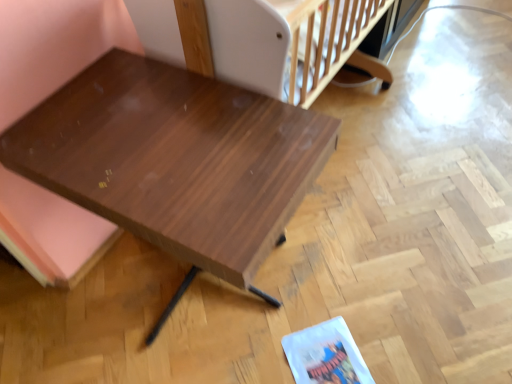
Describe the element at coordinates (175, 161) in the screenshot. The width and height of the screenshot is (512, 384). I see `shiny brown wood table at center` at that location.

You are a GUI agent. You are given a task and a screenshot of the screen. Output one action in this format:
    pyautogui.click(x=<x>, y=<y>)
    Task: Click on the shiny brown wood table at center
    The image size is (512, 384).
    Given the screenshot: What is the action you would take?
    pyautogui.click(x=175, y=161)

The height and width of the screenshot is (384, 512). What are the coordinates of `white plastic infant bed at upper center` in the screenshot? It's located at (288, 42).

Describe the element at coordinates (288, 42) in the screenshot. I see `white plastic infant bed at upper center` at that location.

I want to click on shiny brown wood table at center, so click(x=175, y=161).

Would you say white plastic infant bed at upper center is to the left or to the right of shiny brown wood table at center in the picture?

Clearly, white plastic infant bed at upper center is on the right of shiny brown wood table at center in the image.

Does white plastic infant bed at upper center lie in front of shiny brown wood table at center?

No, it is not.

Between point (264, 43) and point (257, 139), which one is positioned in front?

The point (257, 139) is more forward.

From the image's perspective, which is above, white plastic infant bed at upper center or shiny brown wood table at center?

white plastic infant bed at upper center appears higher in the image.

From a real-world perspective, is white plastic infant bed at upper center positioned under shiny brown wood table at center based on gravity?

No, from a real-world perspective, white plastic infant bed at upper center is not below shiny brown wood table at center.

Is white plastic infant bed at upper center wider or thinner than shiny brown wood table at center?

Clearly, white plastic infant bed at upper center has less width compared to shiny brown wood table at center.

Is white plastic infant bed at upper center taller or shorter than shiny brown wood table at center?

Considering their sizes, white plastic infant bed at upper center has less height than shiny brown wood table at center.

Considering the relative sizes of white plastic infant bed at upper center and shiny brown wood table at center in the image provided, is white plastic infant bed at upper center bigger than shiny brown wood table at center?

Incorrect, white plastic infant bed at upper center is not larger than shiny brown wood table at center.

Is white plastic infant bed at upper center completely or partially outside of shiny brown wood table at center?

Yes, white plastic infant bed at upper center is located beyond the bounds of shiny brown wood table at center.

Is white plastic infant bed at upper center not near shiny brown wood table at center?

No, white plastic infant bed at upper center is not far from shiny brown wood table at center.

Is white plastic infant bed at upper center facing towards shiny brown wood table at center?

No, white plastic infant bed at upper center does not turn towards shiny brown wood table at center.

Measure the distance between white plastic infant bed at upper center and shiny brown wood table at center.

12.18 inches.

You are a GUI agent. You are given a task and a screenshot of the screen. Output one action in this format:
    pyautogui.click(x=<x>, y=<y>)
    Task: Click on the infant bed above the shiny brown wood table at center (from a real-world perspective)
    The image size is (512, 384).
    Given the screenshot: What is the action you would take?
    pyautogui.click(x=288, y=42)

Which is more to the left, shiny brown wood table at center or white plastic infant bed at upper center?

shiny brown wood table at center is more to the left.

Between shiny brown wood table at center and white plastic infant bed at upper center, which one is positioned in front?

shiny brown wood table at center.

Between point (160, 97) and point (291, 74), which one is positioned behind?

The point (291, 74) is behind.

From the image's perspective, relative to white plastic infant bed at upper center, is shiny brown wood table at center above or below?

shiny brown wood table at center is below white plastic infant bed at upper center.

From a real-world perspective, is shiny brown wood table at center on top of white plastic infant bed at upper center?

No, from a real-world perspective, shiny brown wood table at center is not on top of white plastic infant bed at upper center.

In terms of width, does shiny brown wood table at center look wider or thinner when compared to white plastic infant bed at upper center?

Clearly, shiny brown wood table at center has more width compared to white plastic infant bed at upper center.

Can you confirm if shiny brown wood table at center is taller than white plastic infant bed at upper center?

Yes.

From the picture: Considering the sizes of shiny brown wood table at center and white plastic infant bed at upper center in the image, is shiny brown wood table at center bigger or smaller than white plastic infant bed at upper center?

Considering their sizes, shiny brown wood table at center takes up more space than white plastic infant bed at upper center.

Is white plastic infant bed at upper center completely or partially inside shiny brown wood table at center?

No, white plastic infant bed at upper center is not a part of shiny brown wood table at center.

Can you see shiny brown wood table at center touching white plastic infant bed at upper center?

shiny brown wood table at center and white plastic infant bed at upper center are clearly separated.

Is shiny brown wood table at center turned away from white plastic infant bed at upper center?

No, shiny brown wood table at center is not facing away from white plastic infant bed at upper center.

How different are the orientations of shiny brown wood table at center and white plastic infant bed at upper center in degrees?

They differ by 2.48 degrees in their facing directions.

Image resolution: width=512 pixels, height=384 pixels. I want to click on infant bed that appears behind the shiny brown wood table at center, so click(288, 42).

Where is `table to the left of white plastic infant bed at upper center`? Image resolution: width=512 pixels, height=384 pixels. table to the left of white plastic infant bed at upper center is located at coordinates (175, 161).

Image resolution: width=512 pixels, height=384 pixels. I want to click on infant bed located above the shiny brown wood table at center (from a real-world perspective), so click(288, 42).